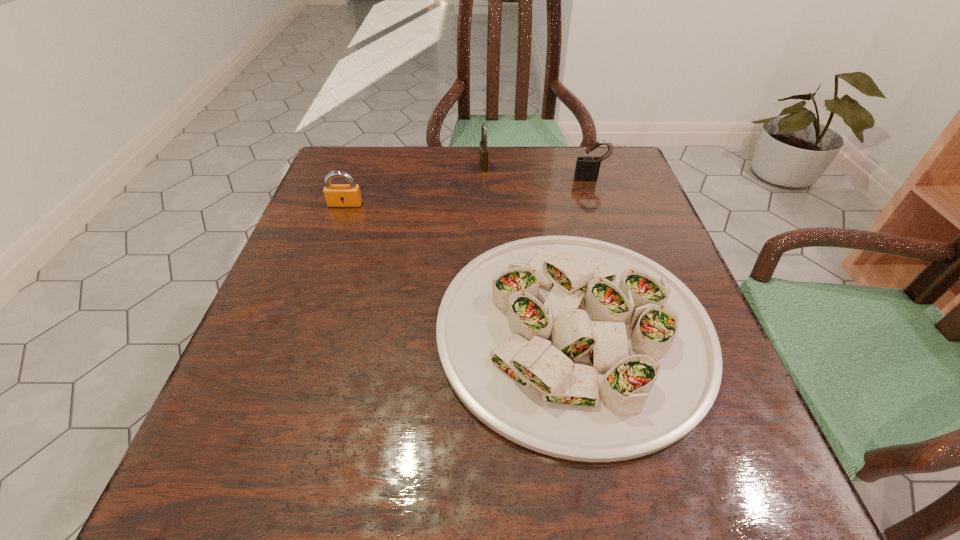
Locate an element on the screen. object that can be found as the third closest to the nearest object is located at coordinates (483, 147).

This screenshot has height=540, width=960. Find the location of `padlock object that ranks as the second closest to the shortest padlock`. padlock object that ranks as the second closest to the shortest padlock is located at coordinates (587, 168).

Select which padlock appears as the third closest to the platter. Please provide its 2D coordinates. Your answer should be formatted as a tuple, i.e. [(x, y)], where the tuple contains the x and y coordinates of a point satisfying the conditions above.

[(483, 147)]

The height and width of the screenshot is (540, 960). What are the coordinates of `free region that satisfies the following two spatial constraints: 1. to unlock the nearest padlock from the front; 2. on the right side of the shortest object` in the screenshot? It's located at (300, 330).

The width and height of the screenshot is (960, 540). Find the location of `blank area in the image that satisfies the following two spatial constraints: 1. to unlock the platter from the front; 2. on the right side of the shortest padlock`. blank area in the image that satisfies the following two spatial constraints: 1. to unlock the platter from the front; 2. on the right side of the shortest padlock is located at coordinates (300, 330).

Locate an element on the screen. free location that satisfies the following two spatial constraints: 1. to unlock the shortest padlock from the front; 2. on the right side of the platter is located at coordinates (300, 330).

At what (x,y) coordinates should I click in order to perform the action: click on vacant space that satisfies the following two spatial constraints: 1. to unlock the leftmost padlock from the front; 2. on the right side of the shortest object. Please return your answer as a coordinate pair (x, y). Image resolution: width=960 pixels, height=540 pixels. Looking at the image, I should click on coord(300,330).